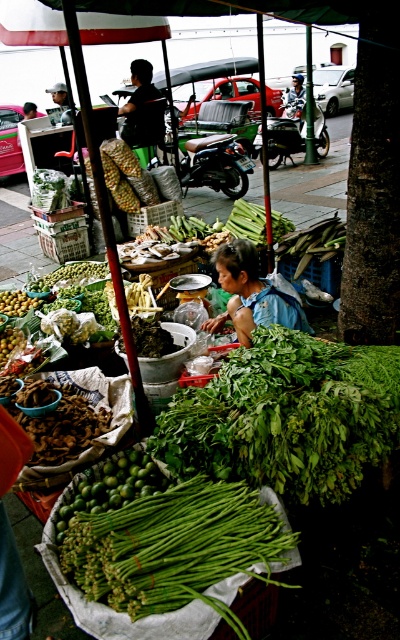
You are a customer at the market and want to pick up the green leafy at center and the green matte asparagus at lower center. Which one is closer to you?

The green leafy at center is closer to you because it is in front of the green matte asparagus at lower center.

Please look at the point marked at coordinates (287, 417). What type of item is located there?

The item at point (287, 417) is green leafy at center.